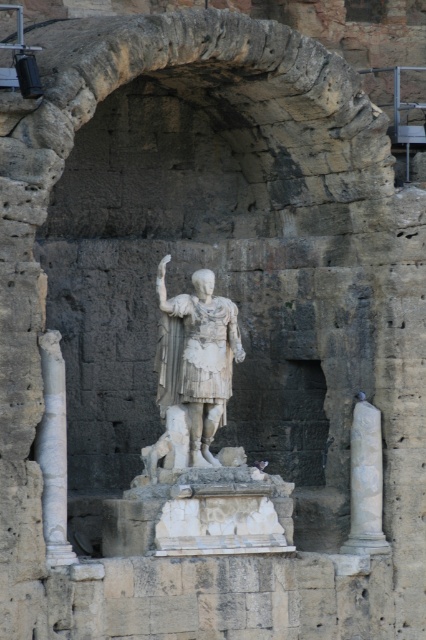
Does white marble column at left appear over white marble column at right?

Correct, white marble column at left is located above white marble column at right.

Does white marble column at left appear under white marble column at right?

Incorrect, white marble column at left is not positioned below white marble column at right.

Who is more forward, (62, 545) or (359, 492)?

Positioned in front is point (62, 545).

Where is `white marble column at left`? The width and height of the screenshot is (426, 640). white marble column at left is located at coordinates (54, 451).

Who is positioned more to the left, white marble statue at center or white marble column at right?

white marble statue at center

Who is lower down, white marble statue at center or white marble column at right?

Positioned lower is white marble column at right.

Does point (196, 300) come closer to viewer compared to point (351, 516)?

Yes.

At what (x,y) coordinates should I click in order to perform the action: click on white marble statue at center. Please return your answer as a coordinate pair (x, y). Looking at the image, I should click on (196, 356).

Can you confirm if white marble statue at center is positioned below white marble column at left?

Actually, white marble statue at center is above white marble column at left.

Consider the image. Does white marble statue at center appear over white marble column at left?

Indeed, white marble statue at center is positioned over white marble column at left.

Between point (232, 365) and point (52, 368), which one is positioned behind?

The point (232, 365) is more distant.

Identify the location of white marble statue at center. (196, 356).